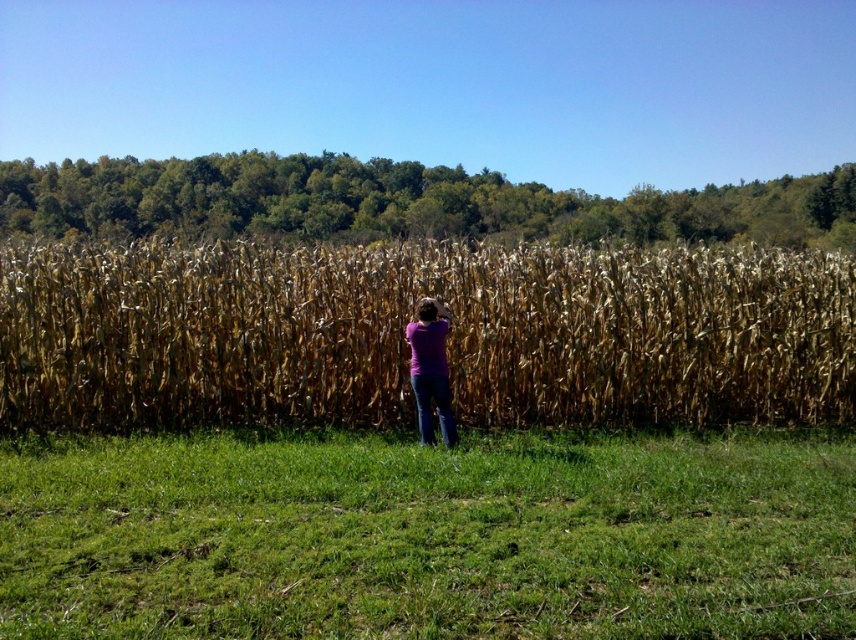
Question: Can you confirm if green grass at lower center is positioned to the left of purple matte shirt at center?

Choices:
 (A) no
 (B) yes

Answer: (B)

Question: Which point appears farthest from the camera in this image?

Choices:
 (A) (325, 554)
 (B) (438, 353)

Answer: (B)

Question: Among these objects, which one is farthest from the camera?

Choices:
 (A) green grass at lower center
 (B) purple matte shirt at center
 (C) dry stalks of corn at center

Answer: (C)

Question: Which point is farther to the camera?

Choices:
 (A) (501, 348)
 (B) (444, 397)

Answer: (A)

Question: Can you confirm if green grass at lower center is positioned to the right of purple matte shirt at center?

Choices:
 (A) yes
 (B) no

Answer: (B)

Question: Is green grass at lower center positioned before purple matte shirt at center?

Choices:
 (A) yes
 (B) no

Answer: (A)